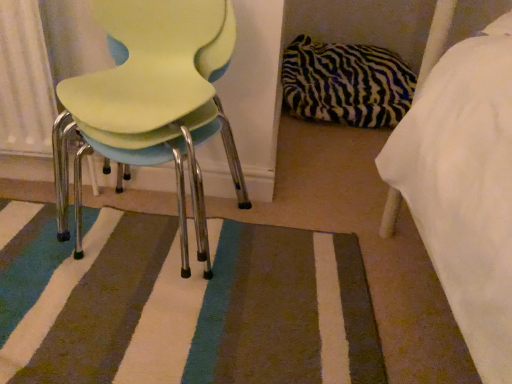
Image resolution: width=512 pixels, height=384 pixels. Identify the location of free space to the right of matte plastic chair at left. coord(298,277).